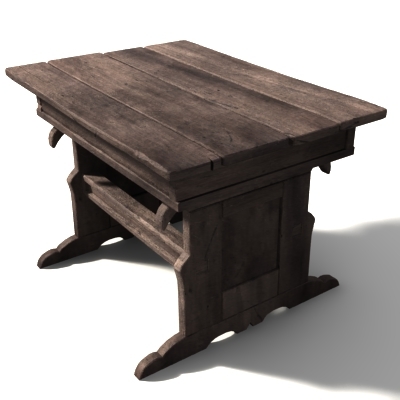
You are a GUI agent. You are given a task and a screenshot of the screen. Output one action in this format:
    pyautogui.click(x=<x>, y=<y>)
    Task: Click on the right side of table
    
    Given the screenshot: What is the action you would take?
    coord(240,246)